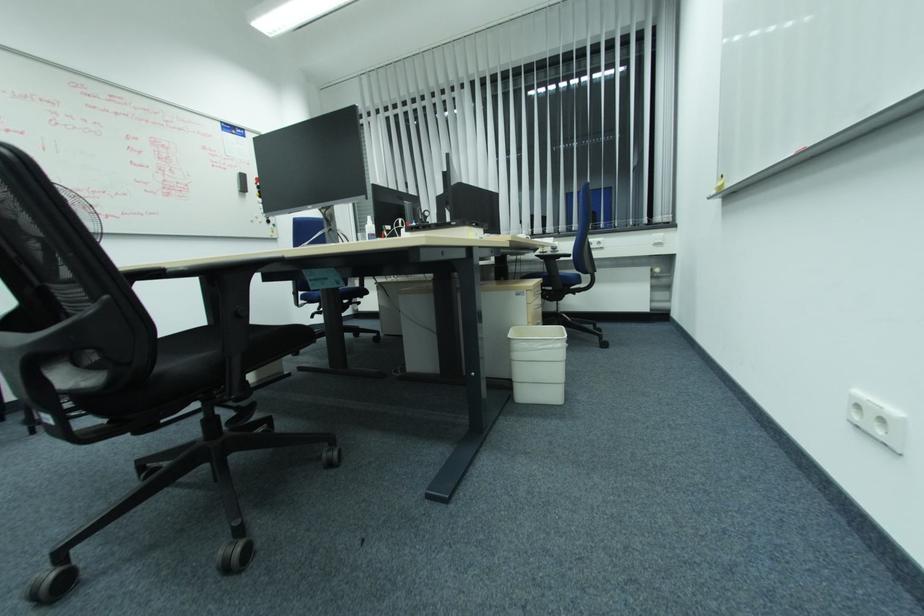
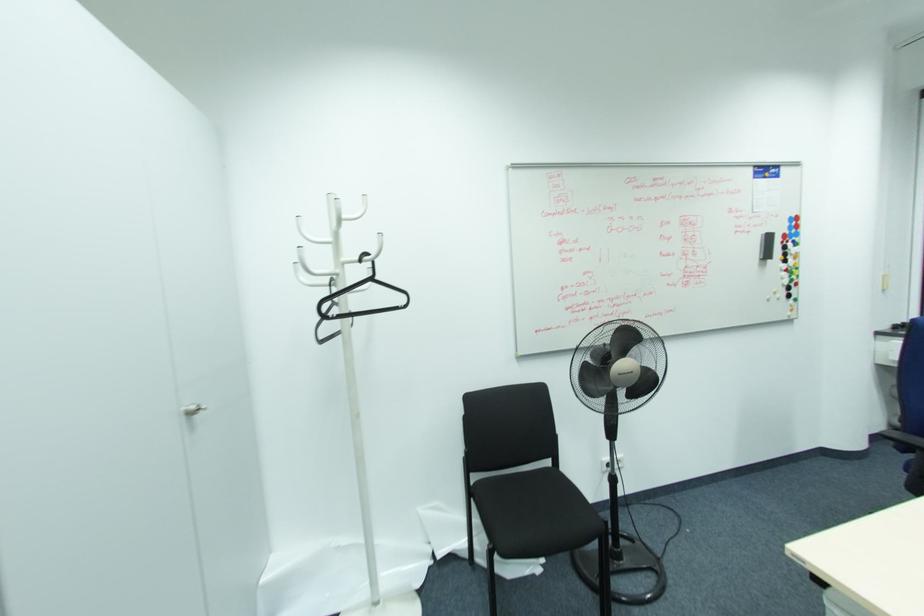
Where in the second image is the point corresponding to [245,188] from the first image?

(768, 256)